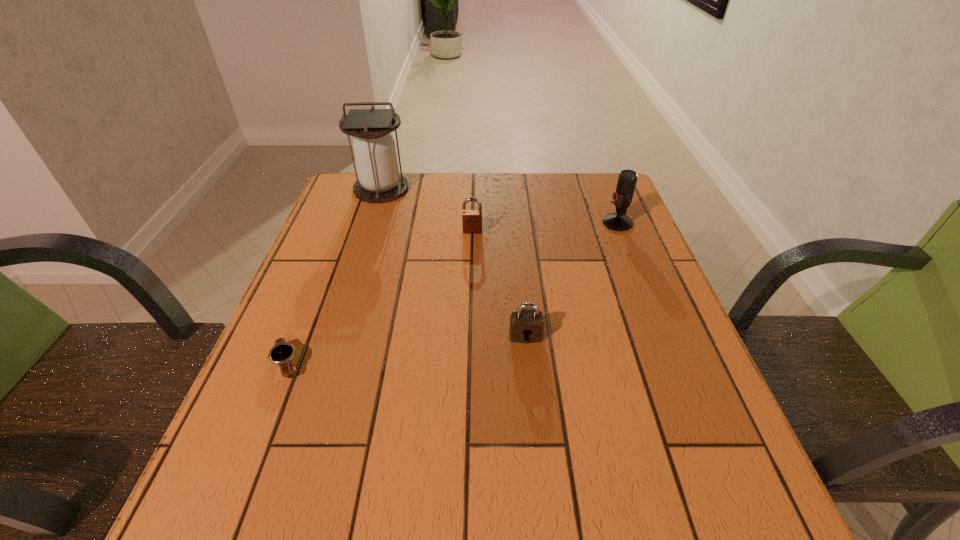
This screenshot has height=540, width=960. In order to click on vacant space situated on the right of the lantern in this screenshot , I will do `click(446, 189)`.

Locate an element on the screen. vacant region located 0.230m on the side of the microphone with the red ring is located at coordinates (516, 223).

What are the coordinates of `vacant position located on the side of the microphone with the red ring` in the screenshot? It's located at (462, 223).

This screenshot has width=960, height=540. In order to click on free location located 0.070m on the side of the microphone with the red ring in this screenshot , I will do `click(576, 223)`.

Locate an element on the screen. free space located on the front-facing side of the farther padlock is located at coordinates (471, 294).

This screenshot has height=540, width=960. What are the coordinates of `vacant region located at the front of the right padlock near the keyhole` in the screenshot? It's located at (532, 402).

Where is `vacant point located on the front of the shortest object`? vacant point located on the front of the shortest object is located at coordinates (x=264, y=418).

This screenshot has width=960, height=540. What are the coordinates of `lantern present at the far edge` in the screenshot? It's located at (379, 181).

Locate an element on the screen. This screenshot has height=540, width=960. microphone at the far edge is located at coordinates (618, 221).

Where is `lantern situated at the left edge`? lantern situated at the left edge is located at coordinates (379, 181).